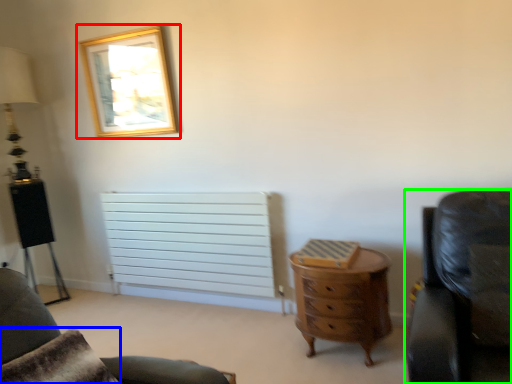
Question: Estimate the real-world distances between objects in this image. Which object is farther from picture frame (highlighted by a red box), pillow (highlighted by a blue box) or chair (highlighted by a green box)?

Choices:
 (A) pillow
 (B) chair

Answer: (B)